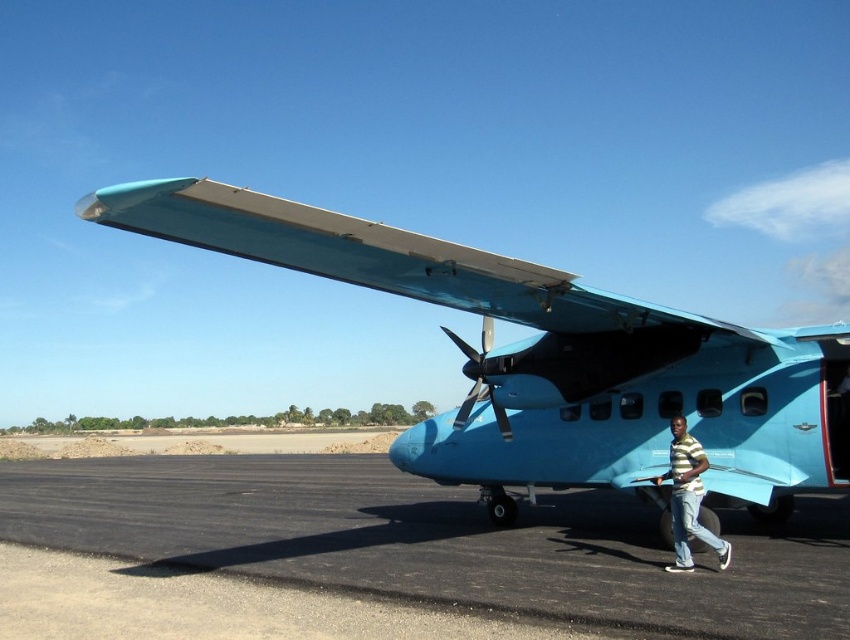
Is striped shirt at lower right positioned before metallic silver propeller at center?

Yes, striped shirt at lower right is in front of metallic silver propeller at center.

Is striped shirt at lower right thinner than metallic silver propeller at center?

Yes, striped shirt at lower right is thinner than metallic silver propeller at center.

Identify the location of striped shirt at lower right. This screenshot has height=640, width=850. (688, 499).

Does light blue matte airplane at center have a larger size compared to black asphalt runway at lower center?

No, light blue matte airplane at center is not bigger than black asphalt runway at lower center.

Is point (462, 440) positioned in front of point (599, 516)?

Yes, point (462, 440) is closer to viewer.

This screenshot has height=640, width=850. I want to click on light blue matte airplane at center, so click(x=551, y=358).

Based on the photo, does black asphalt runway at lower center have a lesser width compared to striped shirt at lower right?

Incorrect, black asphalt runway at lower center's width is not less than striped shirt at lower right's.

Locate an element on the screen. black asphalt runway at lower center is located at coordinates (434, 541).